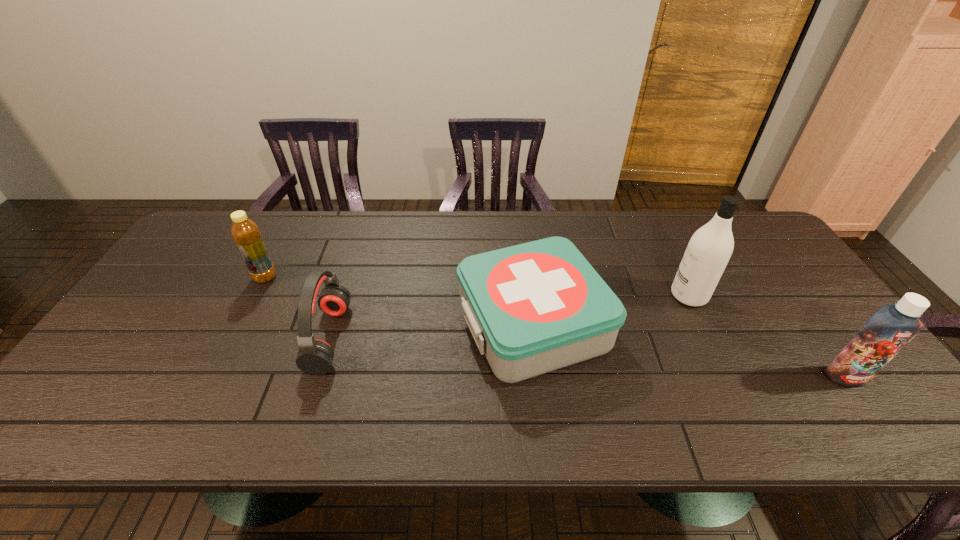
This screenshot has width=960, height=540. What are the coordinates of `vacant space at the near left corner of the desktop` in the screenshot? It's located at (132, 408).

In the image, there is a desktop. Where is `vacant space at the far right corner`? The height and width of the screenshot is (540, 960). vacant space at the far right corner is located at coordinates (760, 252).

This screenshot has height=540, width=960. In order to click on empty space that is in between the earphone and the leftmost object in this screenshot , I will do `click(298, 307)`.

At what (x,y) coordinates should I click in order to perform the action: click on free point between the fourth object from right to left and the leftmost object. Please return your answer as a coordinate pair (x, y). Looking at the image, I should click on (298, 307).

This screenshot has width=960, height=540. In order to click on empty location between the bottle and the second shortest object in this screenshot , I will do `click(298, 307)`.

Find the location of a particular element. vacant area between the fourth tallest object and the leftmost object is located at coordinates (298, 307).

Find the location of `the second closest object to the bottle`. the second closest object to the bottle is located at coordinates (532, 308).

Point out which object is positioned as the second nearest to the fourth tallest object. Please provide its 2D coordinates. Your answer should be formatted as a tuple, i.e. [(x, y)], where the tuple contains the x and y coordinates of a point satisfying the conditions above.

[(532, 308)]